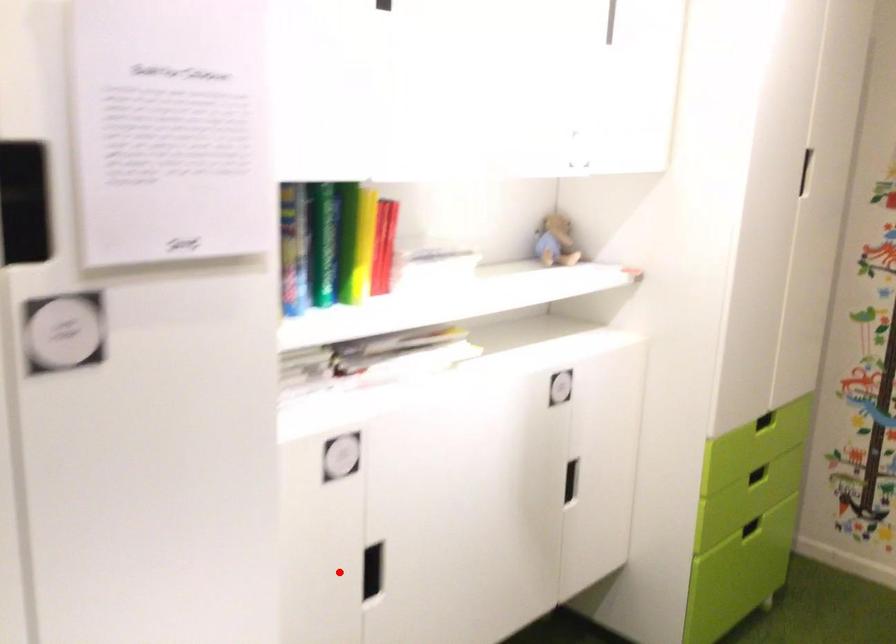
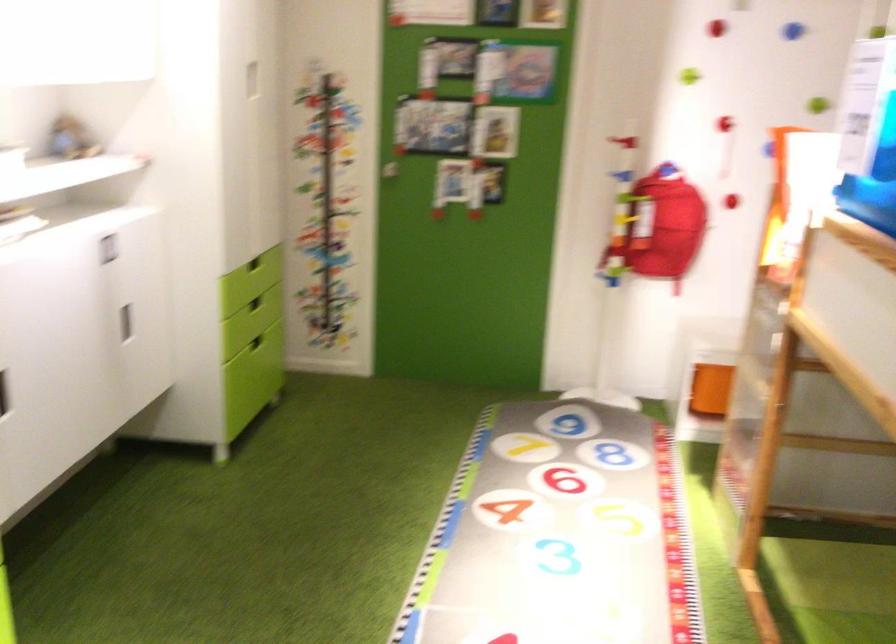
Question: I am providing you with two images of the same scene from different viewpoints. Given a red point in image1, look at the same physical point in image2. Is it:

Choices:
 (A) Closer to the viewpoint
 (B) Farther from the viewpoint

Answer: (B)